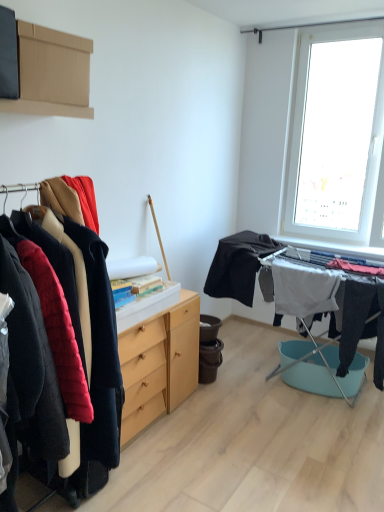
Image resolution: width=384 pixels, height=512 pixels. Describe the element at coordinates (52, 73) in the screenshot. I see `brown cardboard box at upper left` at that location.

This screenshot has height=512, width=384. What do you see at coordinates (238, 265) in the screenshot?
I see `black matte fabric at center, which appears as the 1th clothing when viewed from the left` at bounding box center [238, 265].

In order to face light wood chest of drawers at center, should I rotate leftwards or rightwards?

You should rotate left by 6.313 degrees.

This screenshot has height=512, width=384. In order to click on white fabric at center, the first clothing in the right-to-left sequence in this screenshot , I will do `click(304, 290)`.

In the scene shown: Does white fabric at center, the 2th clothing viewed from the left, have a smaller size compared to black matte fabric at center, the 2th clothing in the right-to-left sequence?

Yes.

You are a GUI agent. You are given a task and a screenshot of the screen. Output one action in this format:
    pyautogui.click(x=<x>, y=<y>)
    Task: Click on the clothing below the black matte fabric at center, the 2th clothing in the right-to-left sequence (from the image's perspective)
    The height and width of the screenshot is (512, 384).
    Given the screenshot: What is the action you would take?
    pyautogui.click(x=304, y=290)

From the image's perspective, which is above, white fabric at center, the first clothing in the right-to-left sequence, or black matte fabric at center, which appears as the 1th clothing when viewed from the left?

black matte fabric at center, which appears as the 1th clothing when viewed from the left, is shown above in the image.

What's the angular difference between white fabric at center, the 2th clothing viewed from the left, and black matte fabric at center, which appears as the 1th clothing when viewed from the left,'s facing directions?

The angular difference between white fabric at center, the 2th clothing viewed from the left, and black matte fabric at center, which appears as the 1th clothing when viewed from the left, is 0.00132 degrees.

Considering the sizes of light wood chest of drawers at center and white fabric at center, the 2th clothing viewed from the left, in the image, is light wood chest of drawers at center taller or shorter than white fabric at center, the 2th clothing viewed from the left,?

light wood chest of drawers at center is taller than white fabric at center, the 2th clothing viewed from the left.

Considering the positions of objects light wood chest of drawers at center and white fabric at center, the first clothing in the right-to-left sequence, in the image provided, who is behind, light wood chest of drawers at center or white fabric at center, the first clothing in the right-to-left sequence,?

Positioned behind is white fabric at center, the first clothing in the right-to-left sequence.

Can you confirm if light wood chest of drawers at center is positioned to the right of white fabric at center, the first clothing in the right-to-left sequence?

No.

Which is nearer, (119, 350) or (316, 286)?

Positioned in front is point (119, 350).

What's the angular difference between black matte fabric at center, which appears as the 1th clothing when viewed from the left, and brown cardboard box at upper left's facing directions?

The angular difference between black matte fabric at center, which appears as the 1th clothing when viewed from the left, and brown cardboard box at upper left is 85.5 degrees.

Which point is more distant from viewer, (252, 298) or (90, 116)?

The point (252, 298) is farther from the camera.

Which of these two, black matte fabric at center, the 2th clothing in the right-to-left sequence, or brown cardboard box at upper left, is smaller?

With smaller size is brown cardboard box at upper left.

In order to click on the 1st clothing below the brown cardboard box at upper left (from the image's perspective) in this screenshot , I will do `click(238, 265)`.

Is point (247, 249) positioned after point (319, 273)?

Yes, point (247, 249) is behind point (319, 273).

Is there a large distance between black matte fabric at center, the 2th clothing in the right-to-left sequence, and white fabric at center, the first clothing in the right-to-left sequence?

No, black matte fabric at center, the 2th clothing in the right-to-left sequence, is not far from white fabric at center, the first clothing in the right-to-left sequence.

How distant is black matte fabric at center, the 2th clothing in the right-to-left sequence, from white fabric at center, the first clothing in the right-to-left sequence?

They are 13.07 inches apart.

Who is shorter, black matte fabric at center, which appears as the 1th clothing when viewed from the left, or white fabric at center, the first clothing in the right-to-left sequence?

Standing shorter between the two is black matte fabric at center, which appears as the 1th clothing when viewed from the left.

Is point (301, 289) closer to viewer compared to point (21, 106)?

No, it is not.

How far apart are white fabric at center, the first clothing in the right-to-left sequence, and brown cardboard box at upper left?

The distance of white fabric at center, the first clothing in the right-to-left sequence, from brown cardboard box at upper left is 5.60 feet.

From the image's perspective, between white fabric at center, the first clothing in the right-to-left sequence, and brown cardboard box at upper left, who is located below?

white fabric at center, the first clothing in the right-to-left sequence, is shown below in the image.

Is white fabric at center, the first clothing in the right-to-left sequence, not inside brown cardboard box at upper left?

Yes, white fabric at center, the first clothing in the right-to-left sequence, is located beyond the bounds of brown cardboard box at upper left.

Looking at this image, considering the relative positions of light wood chest of drawers at center and brown cardboard box at upper left in the image provided, is light wood chest of drawers at center to the right of brown cardboard box at upper left from the viewer's perspective?

Indeed, light wood chest of drawers at center is positioned on the right side of brown cardboard box at upper left.

Is light wood chest of drawers at center next to brown cardboard box at upper left?

No, light wood chest of drawers at center is not beside brown cardboard box at upper left.

Can you confirm if light wood chest of drawers at center is bigger than brown cardboard box at upper left?

Correct, light wood chest of drawers at center is larger in size than brown cardboard box at upper left.

Is brown cardboard box at upper left in front of or behind light wood chest of drawers at center in the image?

brown cardboard box at upper left is positioned closer to the viewer than light wood chest of drawers at center.

Would you say brown cardboard box at upper left is a long distance from light wood chest of drawers at center?

brown cardboard box at upper left is positioned a significant distance from light wood chest of drawers at center.

Locate an element on the screen. chest of drawers to the right of brown cardboard box at upper left is located at coordinates (159, 364).

From the image's perspective, would you say brown cardboard box at upper left is shown under light wood chest of drawers at center?

Incorrect, from the image's perspective, brown cardboard box at upper left is higher than light wood chest of drawers at center.

You are a GUI agent. You are given a task and a screenshot of the screen. Output one action in this format:
    pyautogui.click(x=<x>, y=<y>)
    Task: Click on the clothing beneath the black matte fabric at center, which appears as the 1th clothing when viewed from the left (from a real-world perspective)
    The height and width of the screenshot is (512, 384).
    Given the screenshot: What is the action you would take?
    pyautogui.click(x=304, y=290)

At what (x,y) coordinates should I click in order to perform the action: click on clothing that is the 2nd one when counting backward from the light wood chest of drawers at center. Please return your answer as a coordinate pair (x, y). Looking at the image, I should click on (304, 290).

Considering their positions, is black matte fabric at center, the 2th clothing in the right-to-left sequence, positioned further to light wood chest of drawers at center than white fabric at center, the first clothing in the right-to-left sequence?

white fabric at center, the first clothing in the right-to-left sequence, is positioned further to the anchor light wood chest of drawers at center.

When comparing their distances from black matte fabric at center, which appears as the 1th clothing when viewed from the left, does brown cardboard box at upper left or light wood chest of drawers at center seem further?

The object further to black matte fabric at center, which appears as the 1th clothing when viewed from the left, is brown cardboard box at upper left.

When comparing their distances from white fabric at center, the 2th clothing viewed from the left, does black matte fabric at center, the 2th clothing in the right-to-left sequence, or brown cardboard box at upper left seem closer?

The object closer to white fabric at center, the 2th clothing viewed from the left, is black matte fabric at center, the 2th clothing in the right-to-left sequence.

Based on their spatial positions, is light wood chest of drawers at center or black matte fabric at center, which appears as the 1th clothing when viewed from the left, closer to brown cardboard box at upper left?

light wood chest of drawers at center.

Based on their spatial positions, is white fabric at center, the first clothing in the right-to-left sequence, or black matte fabric at center, which appears as the 1th clothing when viewed from the left, further from light wood chest of drawers at center?

white fabric at center, the first clothing in the right-to-left sequence.

Estimate the real-world distances between objects in this image. Which object is further from white fabric at center, the 2th clothing viewed from the left, brown cardboard box at upper left or black matte fabric at center, the 2th clothing in the right-to-left sequence?

Among the two, brown cardboard box at upper left is located further to white fabric at center, the 2th clothing viewed from the left.

Which object lies further to the anchor point brown cardboard box at upper left, black matte fabric at center, which appears as the 1th clothing when viewed from the left, or light wood chest of drawers at center?

black matte fabric at center, which appears as the 1th clothing when viewed from the left, lies further to brown cardboard box at upper left than the other object.

Considering their positions, is black matte fabric at center, which appears as the 1th clothing when viewed from the left, positioned closer to white fabric at center, the first clothing in the right-to-left sequence, than light wood chest of drawers at center?

The object closer to white fabric at center, the first clothing in the right-to-left sequence, is black matte fabric at center, which appears as the 1th clothing when viewed from the left.

What are the coordinates of `clothing between brown cardboard box at upper left and white fabric at center, the first clothing in the right-to-left sequence, along the z-axis` in the screenshot? It's located at (238, 265).

The width and height of the screenshot is (384, 512). Find the location of `clothing between light wood chest of drawers at center and white fabric at center, the 2th clothing viewed from the left, from left to right`. clothing between light wood chest of drawers at center and white fabric at center, the 2th clothing viewed from the left, from left to right is located at coordinates (238, 265).